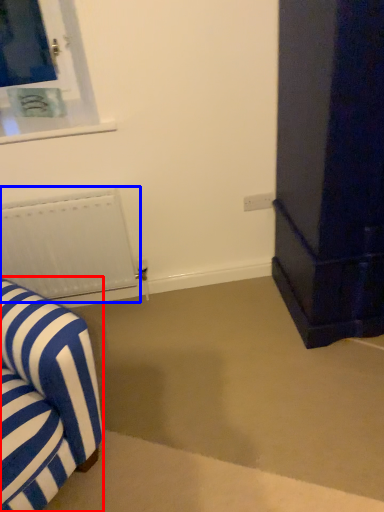
Question: Which point is further to the camera, furniture (highlighted by a red box) or radiator (highlighted by a blue box)?

Choices:
 (A) furniture
 (B) radiator

Answer: (B)